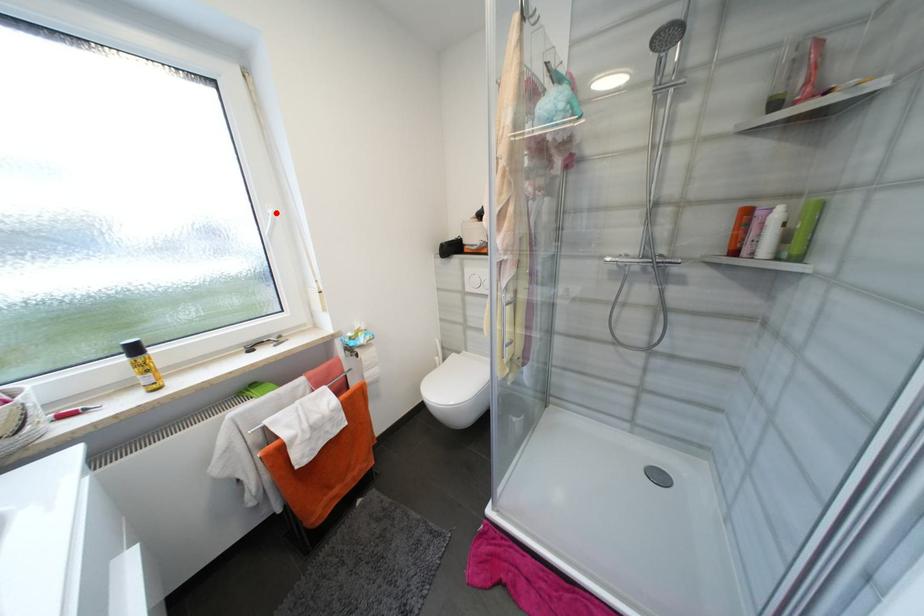
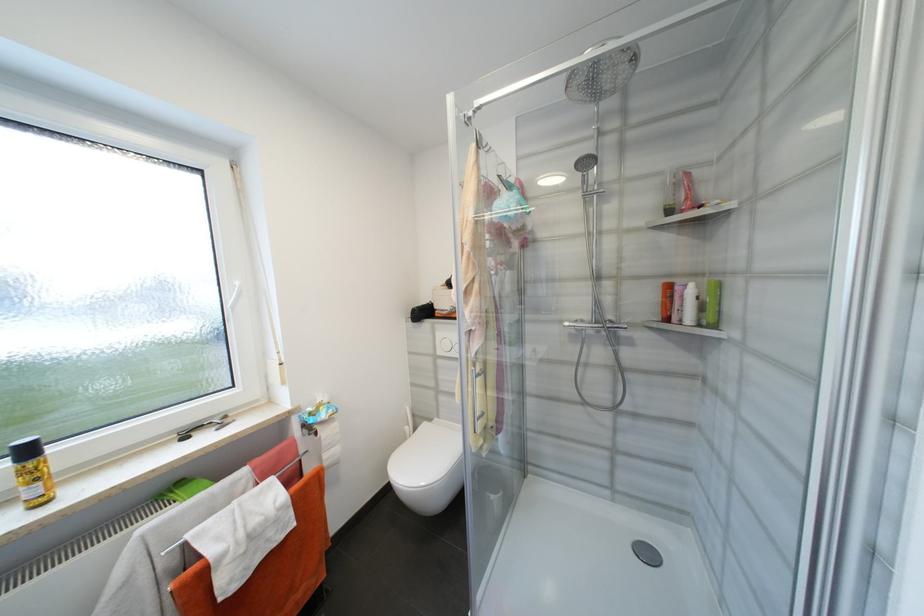
In the second image, find the point that corresponds to the highlighted location in the first image.

(242, 285)